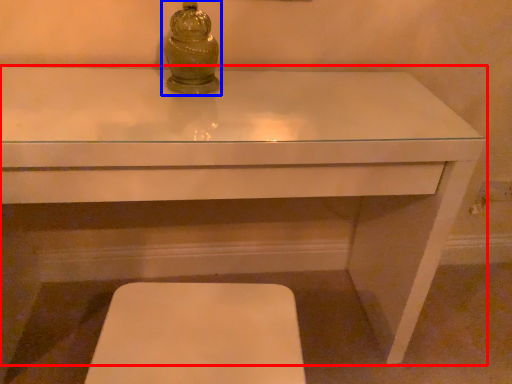
Question: Which object appears closest to the camera in this image, table (highlighted by a red box) or candle holder (highlighted by a blue box)?

Choices:
 (A) table
 (B) candle holder

Answer: (A)